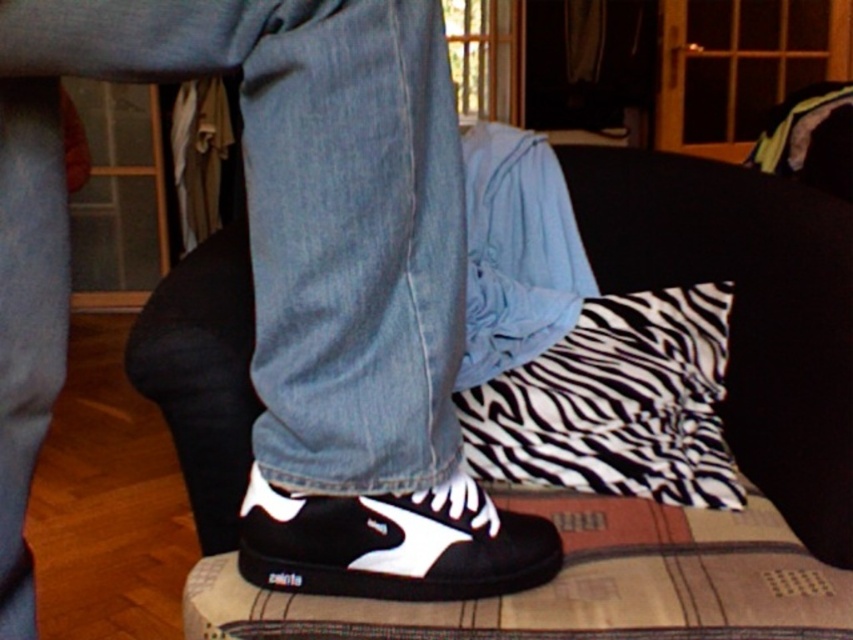
You are trying to decide which pair of shoes to wear today. You have two options in front of you on the couch. The black matte sneakers at center and the black canvas shoe at center. Based on their sizes, which one would you choose if you prefer a more substantial look?

The black matte sneakers at center is larger in size than the black canvas shoe at center, so if you prefer a more substantial look, you should choose the black matte sneakers at center.